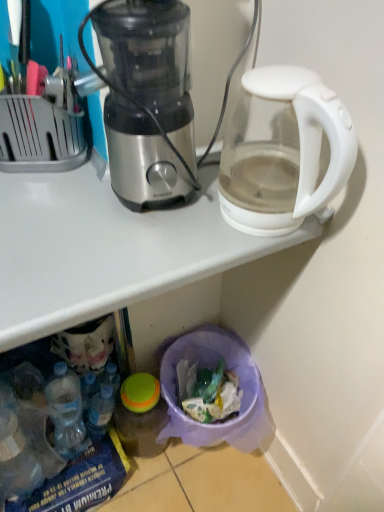
Question: In which direction should I rotate to look at translucent plastic trash can at lower center?

Choices:
 (A) right
 (B) left

Answer: (A)

Question: From the image's perspective, is translucent plastic bottle at lower left above stainless steel blender at center?

Choices:
 (A) yes
 (B) no

Answer: (B)

Question: Could you tell me if translucent plastic bottle at lower left is facing stainless steel blender at center?

Choices:
 (A) no
 (B) yes

Answer: (A)

Question: Is translucent plastic bottle at lower left at the left side of stainless steel blender at center?

Choices:
 (A) no
 (B) yes

Answer: (B)

Question: Is translucent plastic bottle at lower left smaller than stainless steel blender at center?

Choices:
 (A) no
 (B) yes

Answer: (B)

Question: Considering the relative sizes of translucent plastic bottle at lower left and stainless steel blender at center in the image provided, is translucent plastic bottle at lower left shorter than stainless steel blender at center?

Choices:
 (A) no
 (B) yes

Answer: (B)

Question: Can you confirm if translucent plastic bottle at lower left is positioned to the right of stainless steel blender at center?

Choices:
 (A) yes
 (B) no

Answer: (B)

Question: From a real-world perspective, is transparent plastic trash bin at lower center under translucent plastic bottle at lower left?

Choices:
 (A) yes
 (B) no

Answer: (B)

Question: Is transparent plastic trash bin at lower center positioned far away from translucent plastic bottle at lower left?

Choices:
 (A) yes
 (B) no

Answer: (B)

Question: Could you tell me if transparent plastic trash bin at lower center is turned towards translucent plastic bottle at lower left?

Choices:
 (A) no
 (B) yes

Answer: (B)

Question: Is transparent plastic trash bin at lower center oriented away from translucent plastic bottle at lower left?

Choices:
 (A) yes
 (B) no

Answer: (A)

Question: Is transparent plastic trash bin at lower center at the left side of translucent plastic bottle at lower left?

Choices:
 (A) no
 (B) yes

Answer: (A)

Question: Does transparent plastic trash bin at lower center lie in front of translucent plastic bottle at lower left?

Choices:
 (A) no
 (B) yes

Answer: (B)

Question: From a real-world perspective, is translucent plastic bottle at lower left under transparent glass kettle at upper right?

Choices:
 (A) no
 (B) yes

Answer: (B)